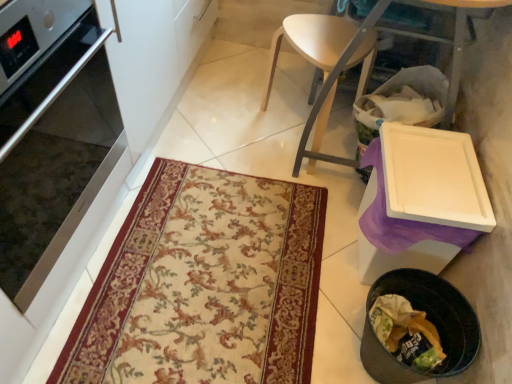
This screenshot has height=384, width=512. Identify the location of vacant space behind light wood chair at center. (279, 78).